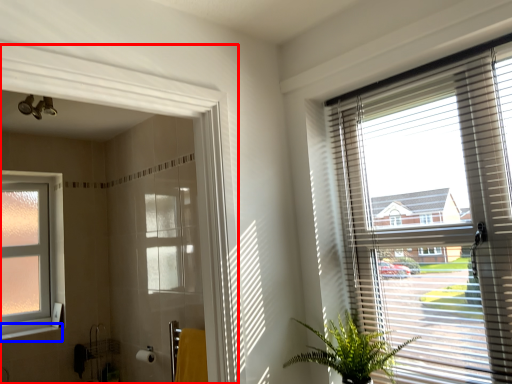
Question: Among these objects, which one is nearest to the camera, screen door (highlighted by a red box) or window sill (highlighted by a blue box)?

Choices:
 (A) screen door
 (B) window sill

Answer: (A)